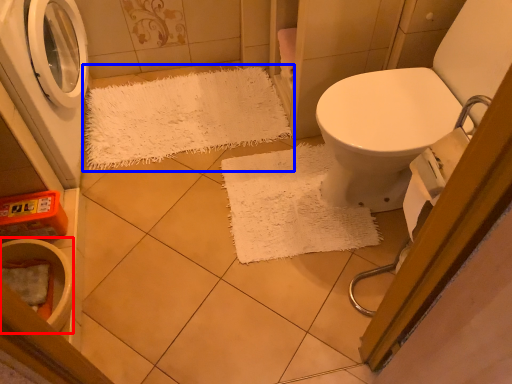
Question: Among these objects, which one is farthest to the camera, toilet bowl (highlighted by a red box) or doormat (highlighted by a blue box)?

Choices:
 (A) toilet bowl
 (B) doormat

Answer: (B)